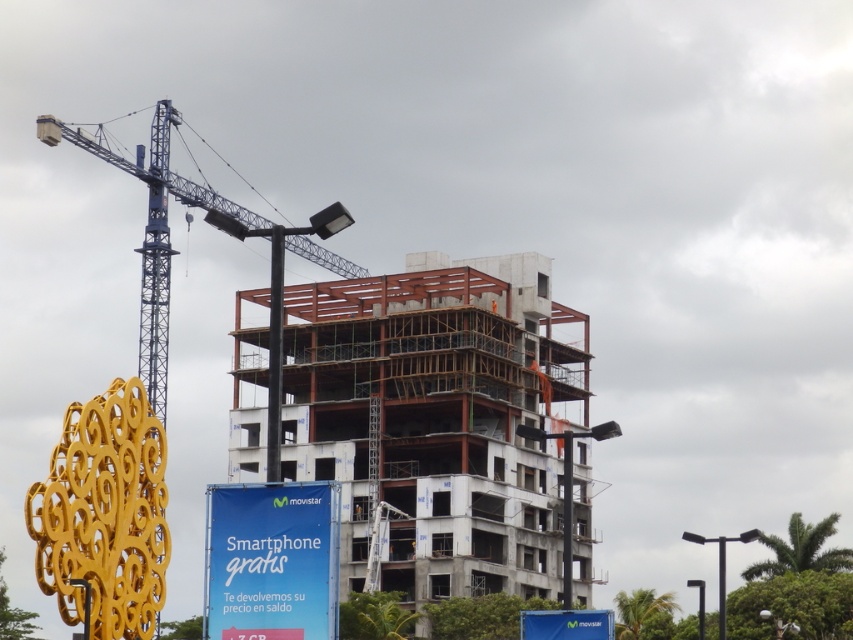
You are a construction worker standing at the base of the crane and want to place a new beam between the two points labeled point (268, 557) and point (148, 339). Which point should you attach the beam to first to ensure proper alignment with the crane?

You should attach the beam to point (268, 557) first because it is closer to the camera, ensuring proper alignment with the crane.

You are standing at the entrance of the construction site and want to locate the blue fabric sign at lower center. According to the coordinates provided, where should you look relative to the blue crane?

The blue fabric sign at lower center is located at coordinates point (271,561), which is to the right and slightly below the blue crane.

You are a construction worker planning to move a heavy equipment from the blue metallic crane at upper left to the white concrete building at center. Considering the spatial constraints, will the equipment fit horizontally between the two structures?

The white concrete building at center is wider than the blue metallic crane at upper left, so the equipment should fit horizontally between them as there is sufficient width.